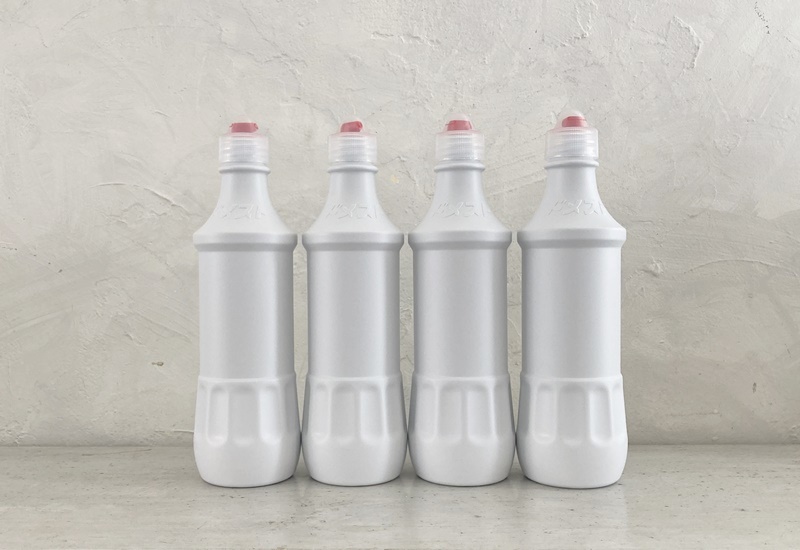
You are a GUI agent. You are given a task and a screenshot of the screen. Output one action in this format:
    pyautogui.click(x=<x>, y=<y>)
    Task: Click on the bottles next to each other
    The height and width of the screenshot is (550, 800).
    Given the screenshot: What is the action you would take?
    pyautogui.click(x=256, y=427), pyautogui.click(x=349, y=403), pyautogui.click(x=470, y=384), pyautogui.click(x=566, y=355)